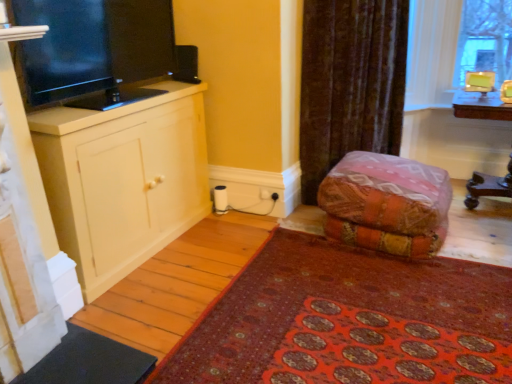
The image size is (512, 384). What do you see at coordinates (349, 320) in the screenshot? I see `red carpet at lower right` at bounding box center [349, 320].

In order to click on black glossy tv at left in this screenshot , I will do `click(91, 46)`.

Image resolution: width=512 pixels, height=384 pixels. Identify the location of velvet brown curtain at upper right. (350, 83).

From their relative heights in the image, would you say velvet brown curtain at upper right is taller or shorter than textured orange fabric at center?

velvet brown curtain at upper right is taller than textured orange fabric at center.

How many degrees apart are the facing directions of velvet brown curtain at upper right and textured orange fabric at center?

The angular difference between velvet brown curtain at upper right and textured orange fabric at center is 50.3 degrees.

Between velvet brown curtain at upper right and textured orange fabric at center, which one appears on the right side from the viewer's perspective?

textured orange fabric at center.

How much distance is there between red carpet at lower right and wooden table at right?

red carpet at lower right is 1.71 meters away from wooden table at right.

Based on the photo, in the image, is red carpet at lower right positioned in front of or behind wooden table at right?

red carpet at lower right is in front of wooden table at right.

Looking at this image, could you tell me if red carpet at lower right is facing wooden table at right?

No.

Considering the relative sizes of red carpet at lower right and wooden table at right in the image provided, is red carpet at lower right thinner than wooden table at right?

No, red carpet at lower right is not thinner than wooden table at right.

Is textured orange fabric at center wider than velvet brown curtain at upper right?

Yes.

From the image's perspective, does textured orange fabric at center appear lower than velvet brown curtain at upper right?

Yes.

Is textured orange fabric at center smaller than velvet brown curtain at upper right?

Indeed, textured orange fabric at center has a smaller size compared to velvet brown curtain at upper right.

Is point (437, 244) positioned in front of point (382, 73)?

Yes.

Does matte white cabinet at left have a greater width compared to velvet brown curtain at upper right?

Correct, the width of matte white cabinet at left exceeds that of velvet brown curtain at upper right.

Locate an element on the screen. This screenshot has width=512, height=384. curtain that appears on the right of matte white cabinet at left is located at coordinates (350, 83).

Considering the sizes of red carpet at lower right and matte white cabinet at left in the image, is red carpet at lower right bigger or smaller than matte white cabinet at left?

Considering their sizes, red carpet at lower right takes up less space than matte white cabinet at left.

Is red carpet at lower right next to matte white cabinet at left and touching it?

No, red carpet at lower right is not with matte white cabinet at left.

Would you say red carpet at lower right is to the left or to the right of matte white cabinet at left in the picture?

Based on their positions, red carpet at lower right is located to the right of matte white cabinet at left.

Could you tell me if red carpet at lower right is facing matte white cabinet at left?

No, red carpet at lower right is not aimed at matte white cabinet at left.

Between black glossy tv at left and velvet brown curtain at upper right, which one has less height?

Standing shorter between the two is black glossy tv at left.

Looking at their sizes, would you say black glossy tv at left is wider or thinner than velvet brown curtain at upper right?

black glossy tv at left is thinner than velvet brown curtain at upper right.

Between point (7, 4) and point (306, 142), which one is positioned behind?

The point (306, 142) is farther.

Find the location of a particular element. The height and width of the screenshot is (384, 512). curtain that appears below the black glossy tv at left (from the image's perspective) is located at coordinates (350, 83).

Between red carpet at lower right and velvet brown curtain at upper right, which one has more height?

Standing taller between the two is velvet brown curtain at upper right.

Considering the sizes of objects red carpet at lower right and velvet brown curtain at upper right in the image provided, who is smaller, red carpet at lower right or velvet brown curtain at upper right?

red carpet at lower right is smaller.

Considering the positions of point (261, 275) and point (383, 32), is point (261, 275) closer or farther from the camera than point (383, 32)?

Point (261, 275) appears to be closer to the viewer than point (383, 32).

Where is `curtain above the textured orange fabric at center (from the image's perspective)`? The image size is (512, 384). curtain above the textured orange fabric at center (from the image's perspective) is located at coordinates (350, 83).

The image size is (512, 384). In order to click on mat in front of the wooden table at right in this screenshot , I will do `click(349, 320)`.

Considering their positions, is matte white cabinet at left positioned closer to red carpet at lower right than black glossy tv at left?

matte white cabinet at left.

Consider the image. From the image, which object appears to be farther from velvet brown curtain at upper right, matte white cabinet at left or red carpet at lower right?

red carpet at lower right is positioned further to the anchor velvet brown curtain at upper right.

Based on their spatial positions, is matte white cabinet at left or wooden table at right closer to velvet brown curtain at upper right?

Based on the image, wooden table at right appears to be nearer to velvet brown curtain at upper right.

When comparing their distances from black glossy tv at left, does wooden table at right or textured orange fabric at center seem further?

wooden table at right lies further to black glossy tv at left than the other object.

Looking at the image, which one is located further to black glossy tv at left, matte white cabinet at left or red carpet at lower right?

The object further to black glossy tv at left is red carpet at lower right.

Based on their spatial positions, is matte white cabinet at left or red carpet at lower right further from wooden table at right?

Among the two, matte white cabinet at left is located further to wooden table at right.

Which object lies nearer to the anchor point matte white cabinet at left, wooden table at right or textured orange fabric at center?

Based on the image, textured orange fabric at center appears to be nearer to matte white cabinet at left.

Looking at the image, which one is located closer to red carpet at lower right, textured orange fabric at center or velvet brown curtain at upper right?

textured orange fabric at center is closer to red carpet at lower right.

Identify the location of television between matte white cabinet at left and textured orange fabric at center from left to right. (91, 46).

The width and height of the screenshot is (512, 384). Find the location of `mat located between matte white cabinet at left and textured orange fabric at center in the left-right direction`. mat located between matte white cabinet at left and textured orange fabric at center in the left-right direction is located at coordinates (349, 320).

Where is `furniture situated between matte white cabinet at left and wooden table at right from left to right`? furniture situated between matte white cabinet at left and wooden table at right from left to right is located at coordinates (386, 204).

Identify the location of television situated between matte white cabinet at left and red carpet at lower right from left to right. Image resolution: width=512 pixels, height=384 pixels. (91, 46).